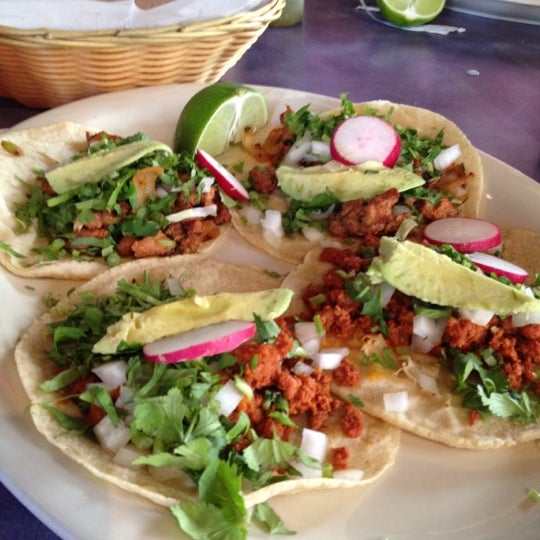
The width and height of the screenshot is (540, 540). I want to click on plate, so click(77, 498), click(484, 33).